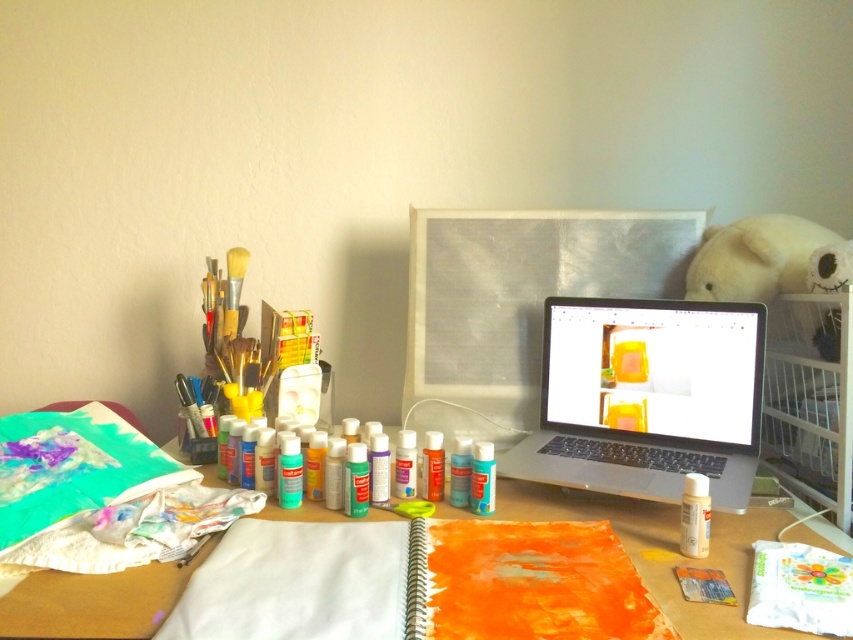
Question: Considering the real-world distances, which object is farthest from the metallic silver monitor at center?

Choices:
 (A) silver metallic laptop at center
 (B) matte orange paper at center

Answer: (B)

Question: Does metallic silver monitor at center have a lesser width compared to matte orange paper at center?

Choices:
 (A) no
 (B) yes

Answer: (B)

Question: Among these points, which one is nearest to the camera?

Choices:
 (A) (674, 605)
 (B) (747, 356)

Answer: (A)

Question: Can you confirm if metallic silver monitor at center is positioned above matte orange paper at center?

Choices:
 (A) no
 (B) yes

Answer: (B)

Question: Which is farther from the matte orange paper at center?

Choices:
 (A) silver metallic laptop at center
 (B) metallic silver monitor at center

Answer: (B)

Question: In this image, where is metallic silver monitor at center located relative to matte orange paper at center?

Choices:
 (A) above
 (B) below

Answer: (A)